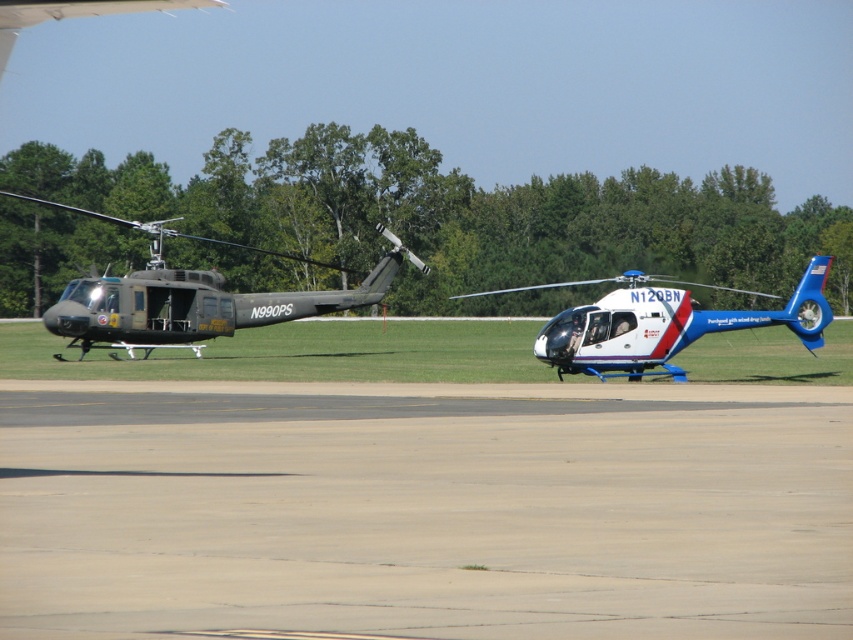
Is smooth concrete runway at center below matte black helicopter at left?

Yes.

Can you confirm if smooth concrete runway at center is positioned to the right of matte black helicopter at left?

Correct, you'll find smooth concrete runway at center to the right of matte black helicopter at left.

What do you see at coordinates (425, 509) in the screenshot? I see `smooth concrete runway at center` at bounding box center [425, 509].

I want to click on smooth concrete runway at center, so click(425, 509).

Who is higher up, matte black helicopter at left or white glossy helicopter at center?

Positioned higher is matte black helicopter at left.

Which is in front, point (314, 296) or point (589, 320)?

Point (589, 320) is in front.

This screenshot has width=853, height=640. In order to click on matte black helicopter at left in this screenshot , I will do `click(189, 296)`.

Between smooth concrete runway at center and white glossy helicopter at center, which one has more height?

white glossy helicopter at center is taller.

Is smooth concrete runway at center taller than white glossy helicopter at center?

No.

Locate an element on the screen. The height and width of the screenshot is (640, 853). smooth concrete runway at center is located at coordinates (425, 509).

At what (x,y) coordinates should I click in order to perform the action: click on smooth concrete runway at center. Please return your answer as a coordinate pair (x, y). The width and height of the screenshot is (853, 640). Looking at the image, I should click on (425, 509).